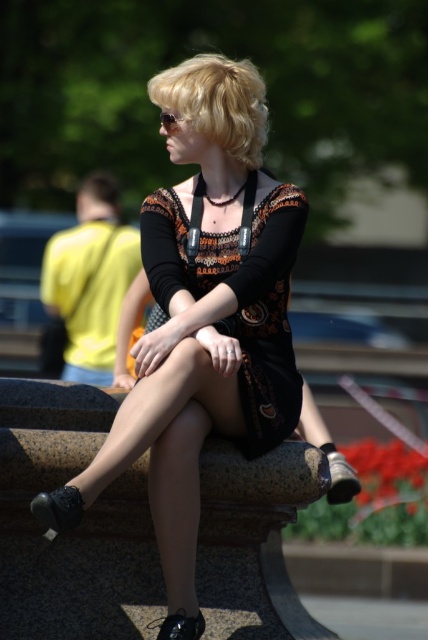
Question: Is black lace dress at center to the right of blonde hair at center from the viewer's perspective?

Choices:
 (A) yes
 (B) no

Answer: (A)

Question: Which point is closer to the camera?

Choices:
 (A) blonde hair at center
 (B) matte black dress at center
 (C) black lace dress at center

Answer: (B)

Question: Which of the following is the farthest from the observer?

Choices:
 (A) (250, 113)
 (B) (275, 289)
 (C) (116, 240)

Answer: (C)

Question: Observing the image, what is the correct spatial positioning of yellow fabric short at left in reference to blonde hair at center?

Choices:
 (A) above
 (B) below

Answer: (B)

Question: Does matte black dress at center appear over black lace dress at center?

Choices:
 (A) yes
 (B) no

Answer: (B)

Question: Among these objects, which one is farthest from the camera?

Choices:
 (A) matte black dress at center
 (B) yellow fabric short at left
 (C) black lace dress at center

Answer: (B)